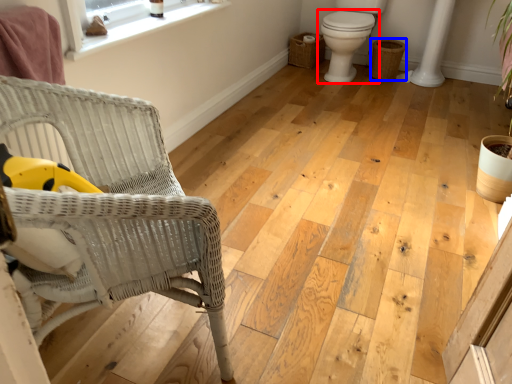
Question: Which of the following is the closest to the observer, toilet (highlighted by a red box) or basket (highlighted by a blue box)?

Choices:
 (A) toilet
 (B) basket

Answer: (A)